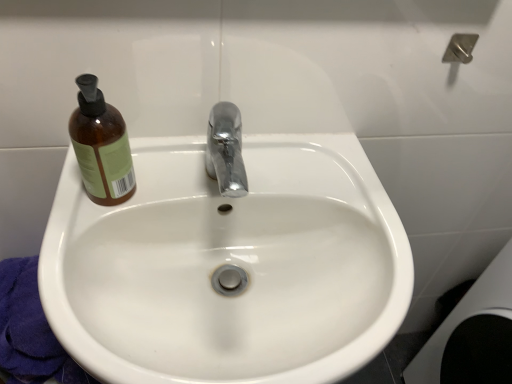
Question: Is white glossy sink at center bigger or smaller than brown glass bottle at upper left?

Choices:
 (A) big
 (B) small

Answer: (A)

Question: Based on their positions, is white glossy sink at center located to the left or right of brown glass bottle at upper left?

Choices:
 (A) left
 (B) right

Answer: (B)

Question: In terms of height, does white glossy sink at center look taller or shorter compared to brown glass bottle at upper left?

Choices:
 (A) short
 (B) tall

Answer: (A)

Question: From the image's perspective, is brown glass bottle at upper left positioned above or below white glossy sink at center?

Choices:
 (A) below
 (B) above

Answer: (B)

Question: Is brown glass bottle at upper left wider or thinner than white glossy sink at center?

Choices:
 (A) thin
 (B) wide

Answer: (A)

Question: Is brown glass bottle at upper left situated inside white glossy sink at center or outside?

Choices:
 (A) inside
 (B) outside

Answer: (B)

Question: Is brown glass bottle at upper left taller or shorter than white glossy sink at center?

Choices:
 (A) short
 (B) tall

Answer: (B)